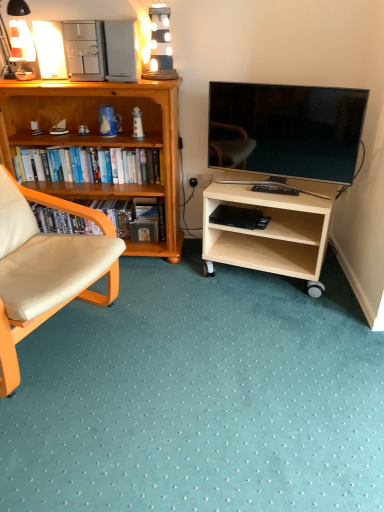
In order to click on vacant space in front of light wood/finished wood tv stand at lower right, the second desk viewed from the left in this screenshot , I will do `click(280, 322)`.